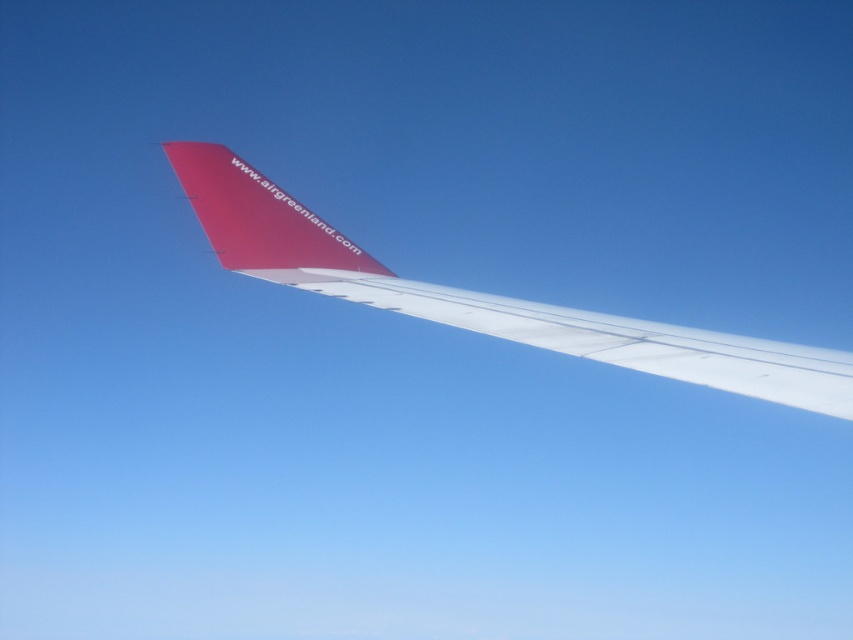
Who is taller, white matte wing at center or smooth red airplane tail at upper center?

smooth red airplane tail at upper center

How distant is white matte wing at center from smooth red airplane tail at upper center?

They are 3.14 meters apart.

Does point (792, 365) come in front of point (334, 259)?

That is True.

At what (x,y) coordinates should I click in order to perform the action: click on white matte wing at center. Please return your answer as a coordinate pair (x, y). The height and width of the screenshot is (640, 853). Looking at the image, I should click on (624, 340).

What do you see at coordinates (485, 296) in the screenshot? The image size is (853, 640). I see `polished white wing at center` at bounding box center [485, 296].

Locate an element on the screen. The image size is (853, 640). polished white wing at center is located at coordinates (485, 296).

Who is shorter, polished white wing at center or smooth red airplane tail at upper center?

polished white wing at center is shorter.

Is polished white wing at center above smooth red airplane tail at upper center?

No.

This screenshot has height=640, width=853. Identify the location of polished white wing at center. (485, 296).